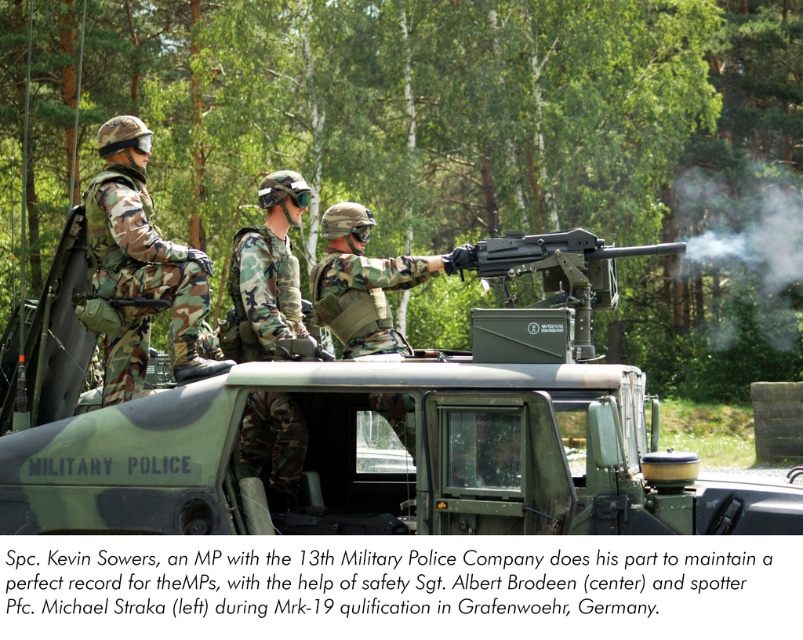
Which is more to the left, camo fabric uniform at left or camo fabric helmet at center?

Positioned to the left is camo fabric uniform at left.

Is camo fabric uniform at left taller than camo fabric helmet at center?

Yes, camo fabric uniform at left is taller than camo fabric helmet at center.

Between point (206, 296) and point (288, 188), which one is positioned in front?

Point (206, 296)

Where is `camo fabric uniform at left`? camo fabric uniform at left is located at coordinates (145, 250).

Is camo fabric uniform at left thinner than matte black machine gun at center?

Correct, camo fabric uniform at left's width is less than matte black machine gun at center's.

Which is behind, point (94, 180) or point (471, 248)?

Positioned behind is point (94, 180).

Who is more forward, (x=123, y=132) or (x=467, y=252)?

Point (x=467, y=252) is more forward.

You are a GUI agent. You are given a task and a screenshot of the screen. Output one action in this format:
    pyautogui.click(x=<x>, y=<y>)
    Task: Click on the camo fabric uniform at left
    
    Given the screenshot: What is the action you would take?
    pyautogui.click(x=145, y=250)

Can you confirm if green matte military vehicle at center is bigger than camo fabric helmet at center?

Yes.

Image resolution: width=803 pixels, height=640 pixels. Describe the element at coordinates (371, 449) in the screenshot. I see `green matte military vehicle at center` at that location.

Image resolution: width=803 pixels, height=640 pixels. Describe the element at coordinates (371, 449) in the screenshot. I see `green matte military vehicle at center` at that location.

Where is `green matte military vehicle at center`? Image resolution: width=803 pixels, height=640 pixels. green matte military vehicle at center is located at coordinates (371, 449).